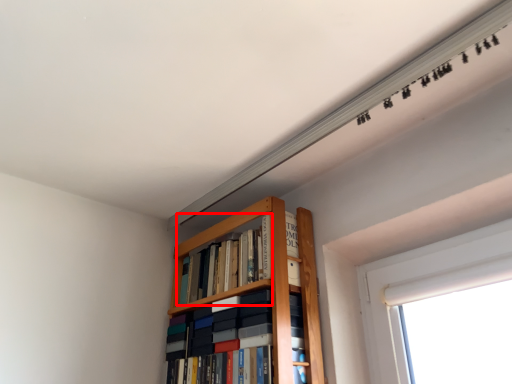
Question: From the image's perspective, what is the correct spatial positioning of book (annotated by the red box) in reference to book?

Choices:
 (A) below
 (B) above

Answer: (B)